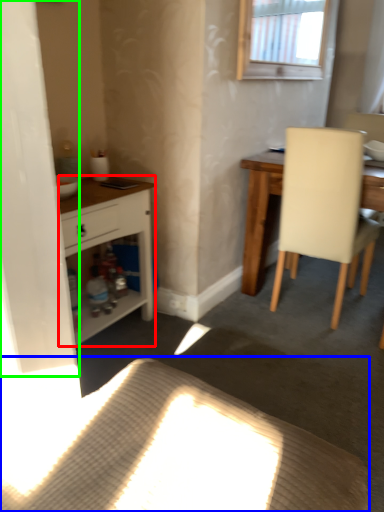
Question: Based on their relative distances, which object is nearer to cabinetry (highlighted by a red box)? Choose from plain (highlighted by a blue box) and screen door (highlighted by a green box).

Choices:
 (A) plain
 (B) screen door

Answer: (B)